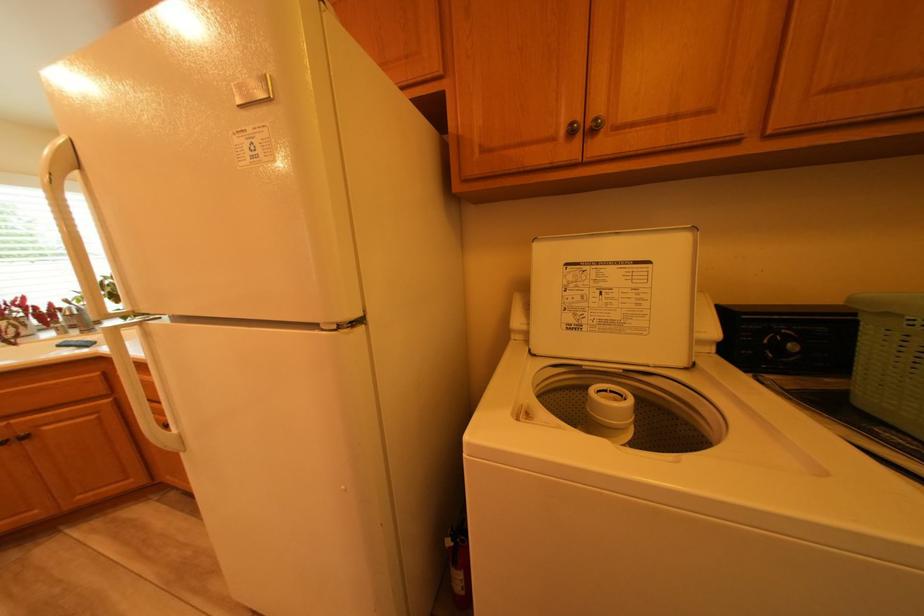
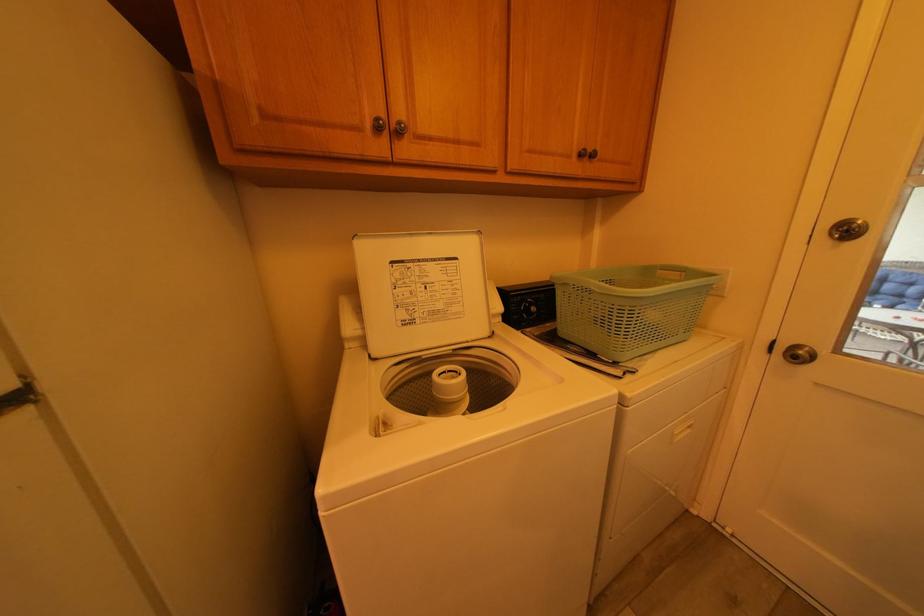
Find the pixel in the second image that matches point (807, 347) in the first image.

(548, 310)